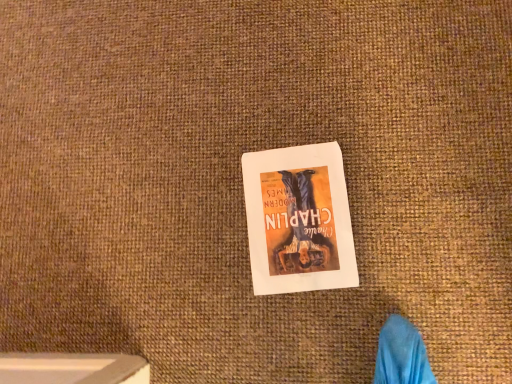
I want to click on vacant area that is in front of white paper at center, so click(380, 301).